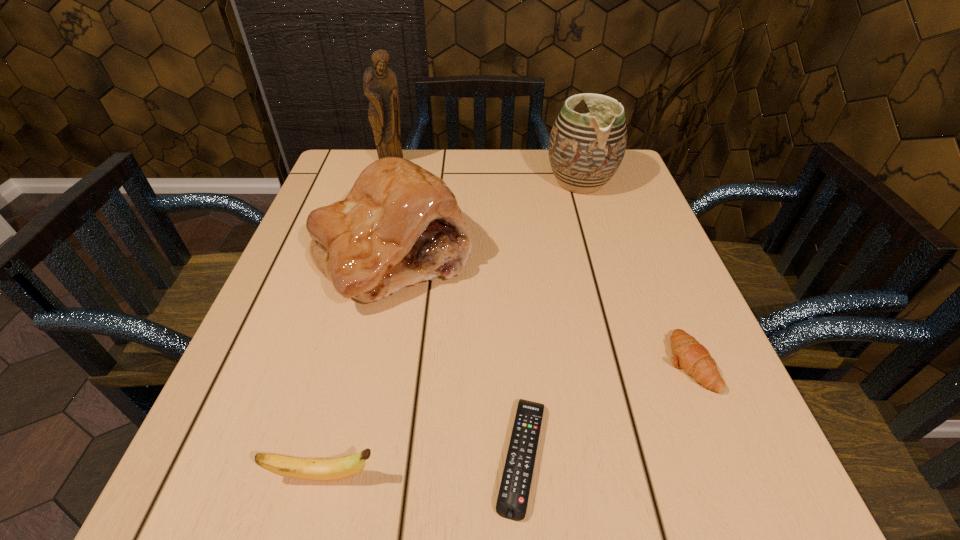
At what (x,y) coordinates should I click in order to perform the action: click on free location at the near left corner of the desktop. Please return your answer as a coordinate pair (x, y). The height and width of the screenshot is (540, 960). Looking at the image, I should click on (188, 514).

I want to click on vacant space at the far right corner of the desktop, so click(626, 194).

This screenshot has width=960, height=540. Find the location of `vacant region at the near right corner`. vacant region at the near right corner is located at coordinates (790, 523).

Locate an element on the screen. Image resolution: width=960 pixels, height=540 pixels. vacant area that lies between the remote control and the fourth tallest object is located at coordinates (422, 466).

I want to click on vacant area that lies between the pottery and the banana, so click(452, 329).

You are a GUI agent. You are given a task and a screenshot of the screen. Output one action in this format:
    pyautogui.click(x=<x>, y=<y>)
    Task: Click on the vacant region between the third shortest object and the fourth object from left to right
    The image size is (960, 540).
    Given the screenshot: What is the action you would take?
    (422, 466)

You are a GUI agent. You are given a task and a screenshot of the screen. Output one action in this format:
    pyautogui.click(x=<x>, y=<y>)
    Task: Click on the vacant region between the fourth farthest object and the remote control
    The height and width of the screenshot is (540, 960).
    Given the screenshot: What is the action you would take?
    pyautogui.click(x=605, y=409)

I want to click on free area in between the pottery and the fifth tallest object, so click(x=635, y=272).

The height and width of the screenshot is (540, 960). Find the location of `empty space that is in between the tallest object and the shortest object`. empty space that is in between the tallest object and the shortest object is located at coordinates (457, 310).

This screenshot has height=540, width=960. What are the coordinates of `vacant space that's between the fifth tallest object and the third shortest object` in the screenshot? It's located at (506, 419).